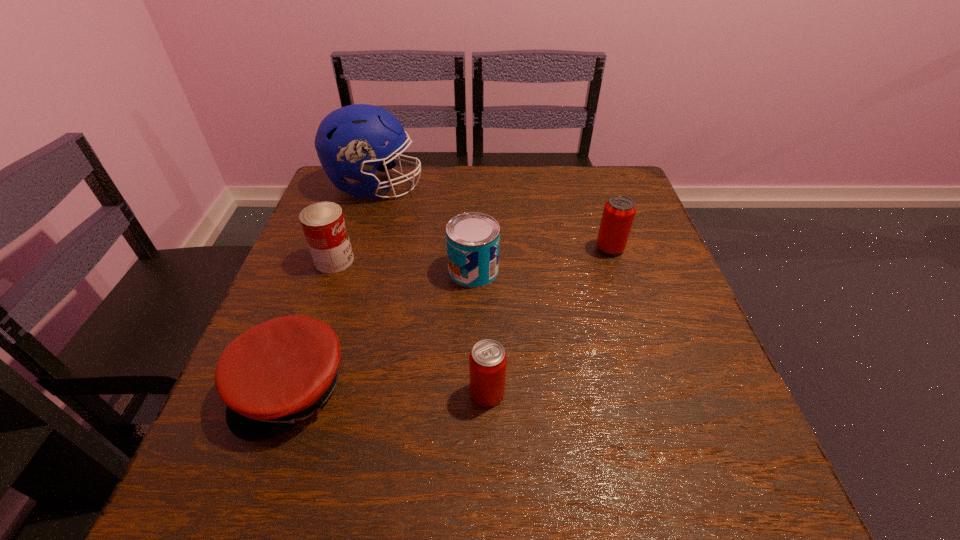
Identify the location of football helmet. (350, 141).

Image resolution: width=960 pixels, height=540 pixels. I want to click on the farthest object, so click(350, 141).

Identify the location of the leftmost can. Image resolution: width=960 pixels, height=540 pixels. (323, 224).

Identify the location of the rightmost object. (619, 211).

The width and height of the screenshot is (960, 540). I want to click on the nearest can, so click(487, 362).

You are a GUI agent. You are given a task and a screenshot of the screen. Output one action in this format:
    pyautogui.click(x=<x>, y=<y>)
    Task: Click on the shortest object
    This screenshot has height=540, width=960.
    Given the screenshot: What is the action you would take?
    pyautogui.click(x=280, y=372)

You are a GUI agent. You are given a task and a screenshot of the screen. Output one action in this format:
    pyautogui.click(x=<x>, y=<y>)
    Task: Click on the free location located on the front-facing side of the tallest object
    This screenshot has width=960, height=540.
    Given the screenshot: What is the action you would take?
    pyautogui.click(x=572, y=187)

Image resolution: width=960 pixels, height=540 pixels. I want to click on vacant space located on the front label of the leftmost can, so click(463, 260).

Identify the location of vacant point located on the back of the rightmost can. This screenshot has height=540, width=960. (602, 224).

The height and width of the screenshot is (540, 960). I want to click on vacant position located 0.070m on the back of the nearest can, so click(x=487, y=345).